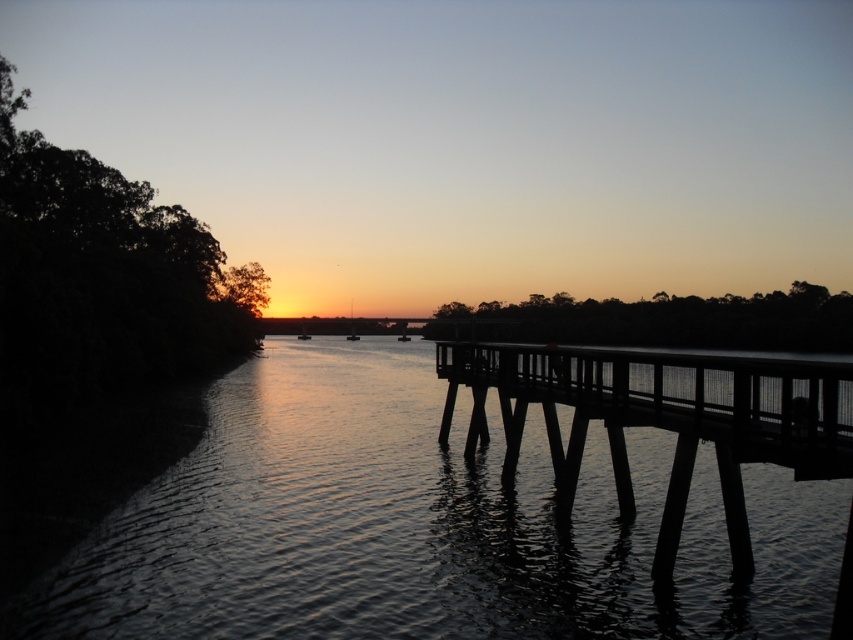
You are standing at the wooden pier on the right side of the image. Looking towards the center, you notice a specific point marked at coordinates (422,525). What is located at that point?

The point marked at coordinates (422,525) is dark water at center.

You are standing on the wooden pier in the sunset scene. You notice two points marked in the image. The first point is at coordinates point [410,480] and the second is at point [816,436]. From your position on the pier, which point is closer to you?

Point [816,436] is closer to you because the description states that point [410,480] is behind point [816,436].